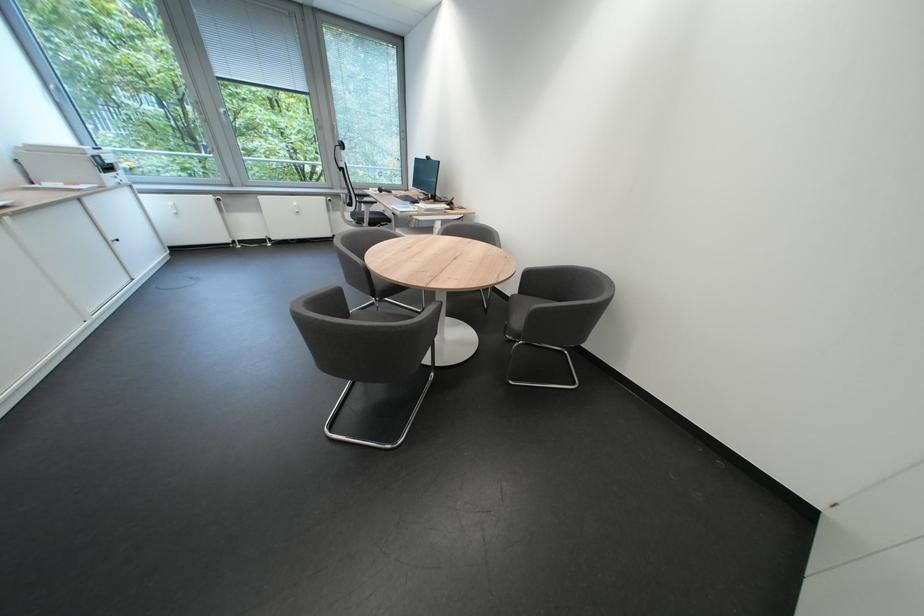
Describe the element at coordinates (365, 201) in the screenshot. I see `the black office chair armrest` at that location.